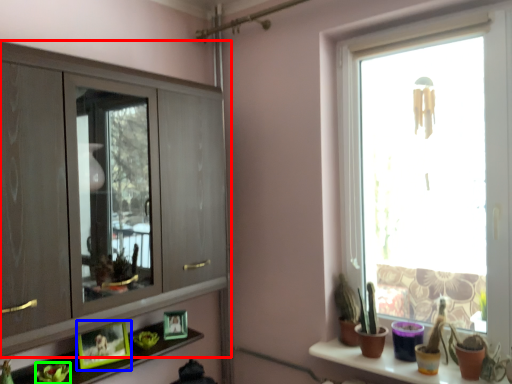
Question: Which object is positioned farthest from cupboard (highlighted by a red box)? Select from picture frame (highlighted by a blue box) and plant (highlighted by a green box).

Choices:
 (A) picture frame
 (B) plant

Answer: (B)